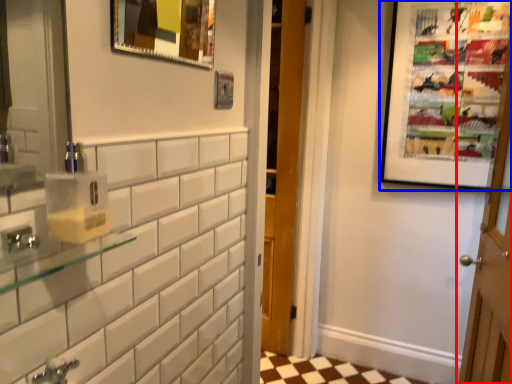
Question: Which of the following is the closest to the observer, door (highlighted by a red box) or picture frame (highlighted by a blue box)?

Choices:
 (A) door
 (B) picture frame

Answer: (A)